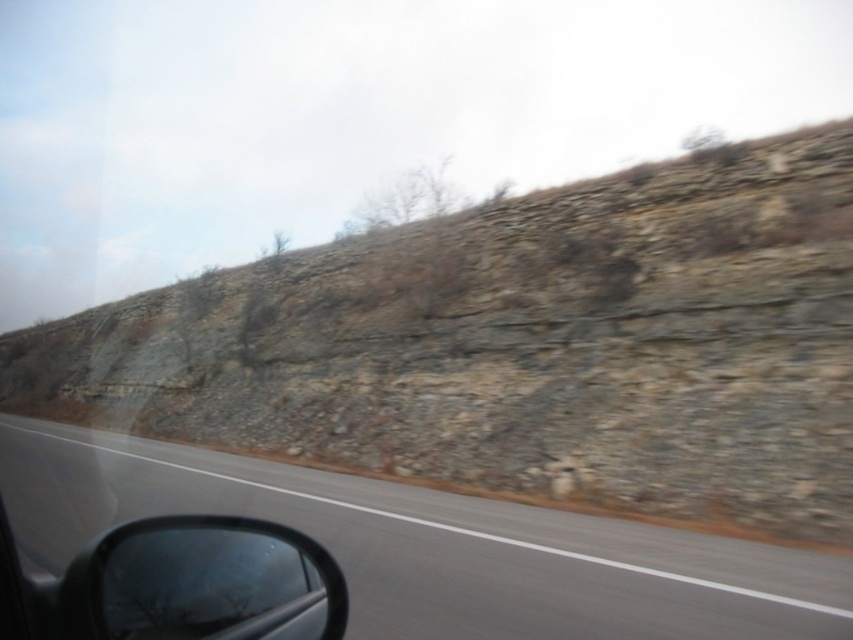
Question: Is gray asphalt road at lower left below black matte side mirror at lower left?

Choices:
 (A) no
 (B) yes

Answer: (B)

Question: Which object is closer to the camera taking this photo?

Choices:
 (A) black matte side mirror at lower left
 (B) rocky terrain at upper right

Answer: (A)

Question: Based on their relative distances, which object is farther from the rocky terrain at upper right?

Choices:
 (A) gray asphalt road at lower left
 (B) black matte side mirror at lower left

Answer: (B)

Question: Which point is farther to the camera?

Choices:
 (A) black matte side mirror at lower left
 (B) gray asphalt road at lower left
 (C) rocky terrain at upper right

Answer: (C)

Question: Can you confirm if rocky terrain at upper right is positioned to the left of gray asphalt road at lower left?

Choices:
 (A) no
 (B) yes

Answer: (B)

Question: Is rocky terrain at upper right to the left of gray asphalt road at lower left from the viewer's perspective?

Choices:
 (A) yes
 (B) no

Answer: (A)